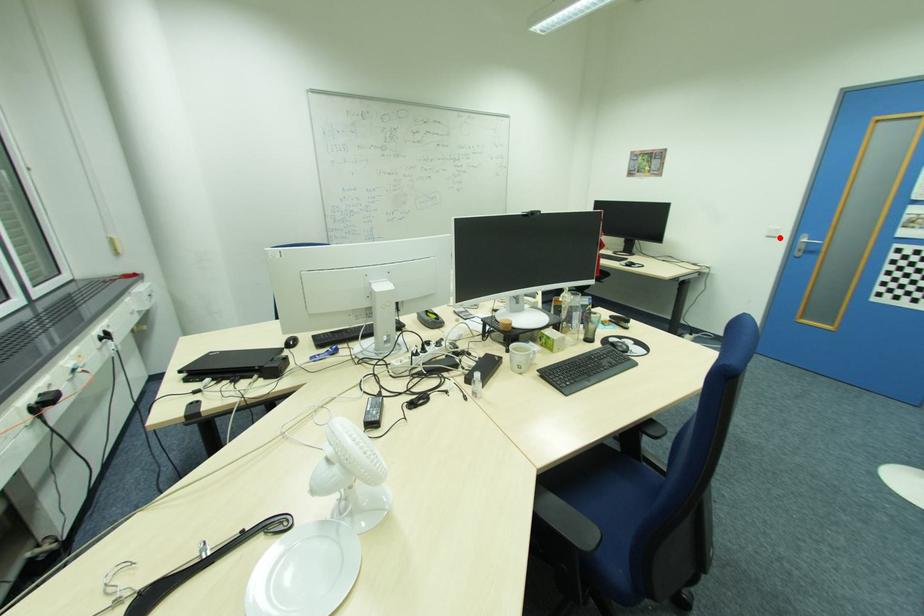
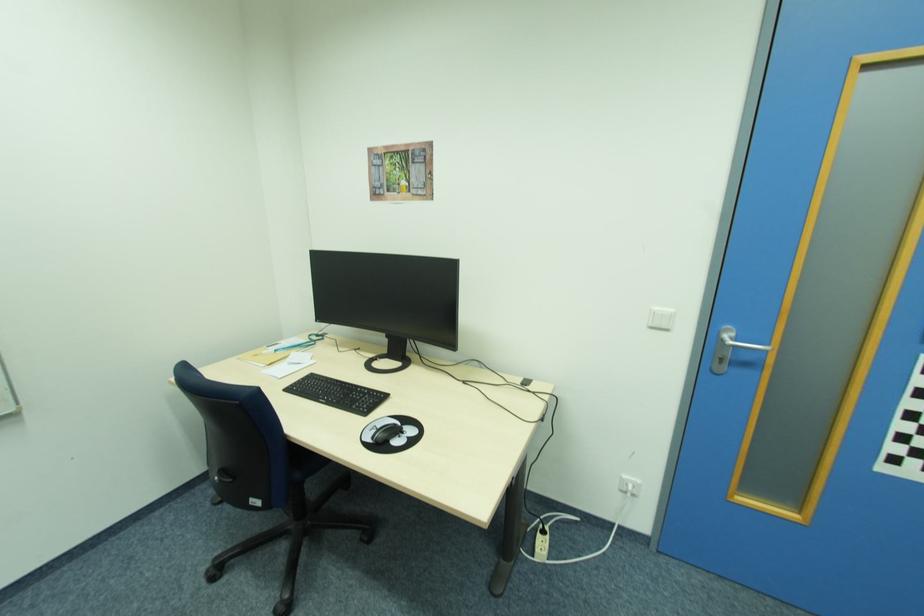
Find the pixel in the second image that matches the highlighted location in the first image.

(670, 329)